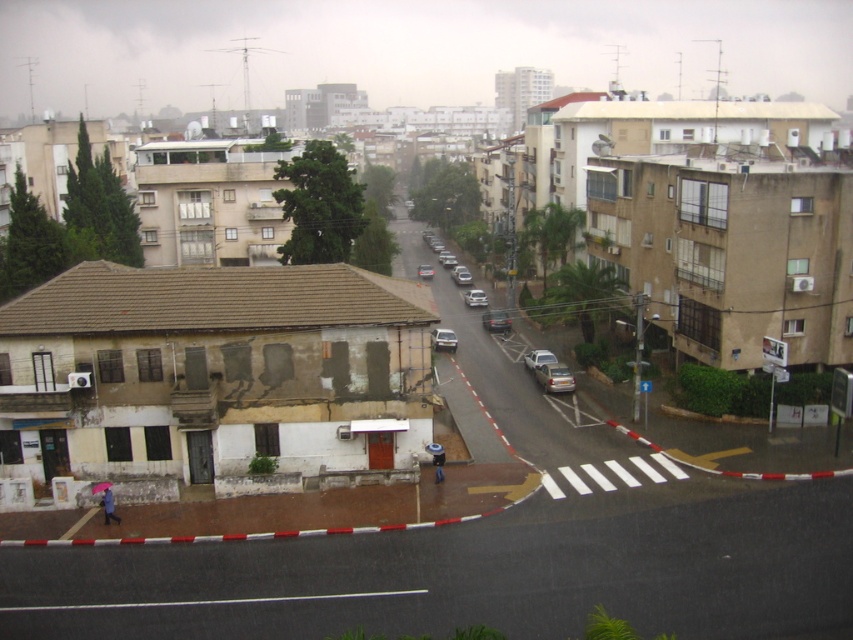
You are standing on the elevated viewpoint looking at the urban street scene. There are two points marked in the image, point A at coordinates point (x=543, y=385) and point B at coordinates point (x=466, y=282). Which point is closer to your current position?

Point point (x=543, y=385) is closer to the camera than point point (x=466, y=282), so point A is closer to your current position.